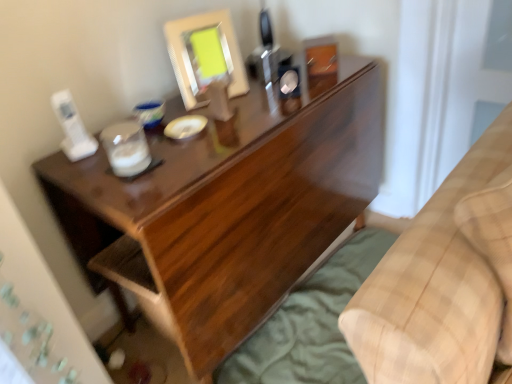
Question: From a real-world perspective, is beige plaid blanket at lower right physically below dark wood desk at center?

Choices:
 (A) no
 (B) yes

Answer: (A)

Question: Does beige plaid blanket at lower right have a lesser height compared to dark wood desk at center?

Choices:
 (A) yes
 (B) no

Answer: (A)

Question: Is dark wood desk at center located within beige plaid blanket at lower right?

Choices:
 (A) yes
 (B) no

Answer: (B)

Question: Is beige plaid blanket at lower right oriented away from dark wood desk at center?

Choices:
 (A) yes
 (B) no

Answer: (A)

Question: Is beige plaid blanket at lower right behind dark wood desk at center?

Choices:
 (A) yes
 (B) no

Answer: (B)

Question: Is beige plaid blanket at lower right not close to dark wood desk at center?

Choices:
 (A) no
 (B) yes

Answer: (A)

Question: Are green fabric sheet at lower right and dark wood desk at center making contact?

Choices:
 (A) no
 (B) yes

Answer: (A)

Question: From a real-world perspective, is green fabric sheet at lower right beneath dark wood desk at center?

Choices:
 (A) no
 (B) yes

Answer: (B)

Question: Could you tell me if green fabric sheet at lower right is turned towards dark wood desk at center?

Choices:
 (A) no
 (B) yes

Answer: (A)

Question: Does green fabric sheet at lower right appear on the right side of dark wood desk at center?

Choices:
 (A) no
 (B) yes

Answer: (B)

Question: Does green fabric sheet at lower right appear on the left side of dark wood desk at center?

Choices:
 (A) yes
 (B) no

Answer: (B)

Question: Does green fabric sheet at lower right have a greater width compared to dark wood desk at center?

Choices:
 (A) no
 (B) yes

Answer: (B)

Question: Considering the relative positions of dark wood desk at center and beige plaid blanket at lower right in the image provided, is dark wood desk at center in front of beige plaid blanket at lower right?

Choices:
 (A) yes
 (B) no

Answer: (B)